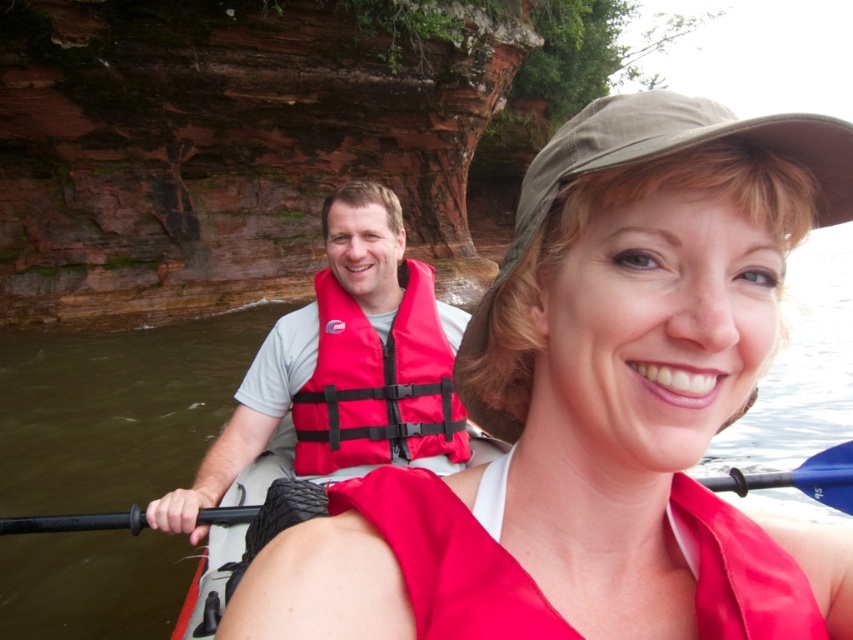
You are a lifeguard observing the kayakers and need to ensure their safety. Which life jacket is more appropriate for the woman in the foreground based on size? The red matte life jacket at center or the red nylon life jacket at center?

The red matte life jacket at center is smaller than the red nylon life jacket at center. The woman in the foreground should wear the red matte life jacket at center as it is the appropriate size for her.

You are standing on the dock and want to take a photo of the point at coordinates (x=750, y=186). The camera you have can focus on objects up to 5 meters away. Will the point be in focus?

The point at coordinates (x=750, y=186) is 6.06 meters away from the camera, which is beyond the camera focus range of 5 meters. Therefore, the point will not be in focus.

You are a photographer trying to capture a photo of the black rubber paddle at center and the red nylon life jacket at center. From the camera position, which object is positioned to the left?

The red nylon life jacket at center is to the left of the black rubber paddle at center.